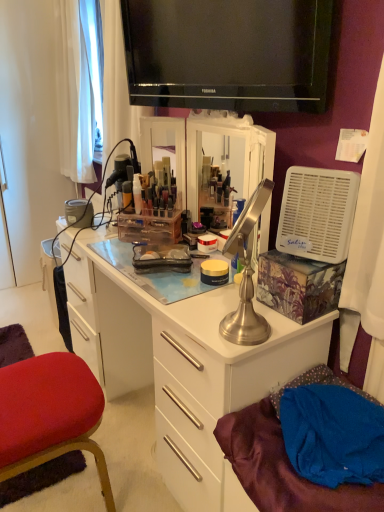
Question: Are satin silver desk at center and velvet red chair at lower left located far from each other?

Choices:
 (A) no
 (B) yes

Answer: (A)

Question: Does satin silver desk at center have a smaller size compared to velvet red chair at lower left?

Choices:
 (A) no
 (B) yes

Answer: (A)

Question: Does satin silver desk at center have a greater width compared to velvet red chair at lower left?

Choices:
 (A) yes
 (B) no

Answer: (B)

Question: Does satin silver desk at center contain velvet red chair at lower left?

Choices:
 (A) no
 (B) yes

Answer: (A)

Question: Is satin silver desk at center bigger than velvet red chair at lower left?

Choices:
 (A) no
 (B) yes

Answer: (B)

Question: Can you confirm if satin silver desk at center is positioned to the right of velvet red chair at lower left?

Choices:
 (A) yes
 (B) no

Answer: (A)

Question: From a real-world perspective, is white plastic fan at right physically below satin silver lamp at center?

Choices:
 (A) yes
 (B) no

Answer: (B)

Question: Is the surface of white plastic fan at right in direct contact with satin silver lamp at center?

Choices:
 (A) yes
 (B) no

Answer: (B)

Question: Is white plastic fan at right shorter than satin silver lamp at center?

Choices:
 (A) no
 (B) yes

Answer: (B)

Question: Would you say white plastic fan at right contains satin silver lamp at center?

Choices:
 (A) yes
 (B) no

Answer: (B)

Question: Considering the relative positions of white plastic fan at right and satin silver lamp at center in the image provided, is white plastic fan at right to the right of satin silver lamp at center from the viewer's perspective?

Choices:
 (A) no
 (B) yes

Answer: (B)

Question: Considering the relative sizes of white plastic fan at right and satin silver lamp at center in the image provided, is white plastic fan at right wider than satin silver lamp at center?

Choices:
 (A) no
 (B) yes

Answer: (B)

Question: Can you confirm if satin silver lamp at center is bigger than velvet red chair at lower left?

Choices:
 (A) no
 (B) yes

Answer: (A)